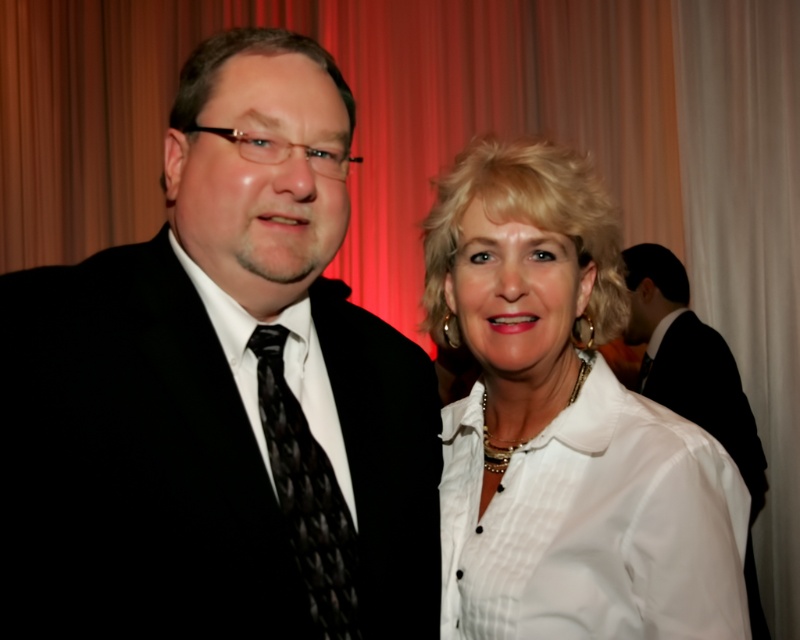
Between black satin suit at left and white satin blouse at center, which one has more height?

With more height is black satin suit at left.

At what (x,y) coordinates should I click in order to perform the action: click on black satin suit at left. Please return your answer as a coordinate pair (x, y). Looking at the image, I should click on (220, 394).

Where is `black satin suit at left`? Image resolution: width=800 pixels, height=640 pixels. black satin suit at left is located at coordinates tap(220, 394).

You are a GUI agent. You are given a task and a screenshot of the screen. Output one action in this format:
    pyautogui.click(x=<x>, y=<y>)
    Task: Click on the black satin suit at left
    The height and width of the screenshot is (640, 800).
    Given the screenshot: What is the action you would take?
    [x=220, y=394]

Who is shorter, black satin suit at left or black satin suit at right?

Standing shorter between the two is black satin suit at left.

Who is higher up, black satin suit at left or black satin suit at right?

black satin suit at left

Find the location of a particular element. Image resolution: width=800 pixels, height=640 pixels. black satin suit at left is located at coordinates (220, 394).

Does black satin suit at left have a greater height compared to black textured tie at left?

Indeed, black satin suit at left has a greater height compared to black textured tie at left.

Can you confirm if black satin suit at left is positioned above black textured tie at left?

Indeed, black satin suit at left is positioned over black textured tie at left.

Who is more distant from viewer, (x=194, y=452) or (x=262, y=394)?

The point (x=262, y=394) is more distant.

This screenshot has width=800, height=640. Identify the location of black satin suit at left. (220, 394).